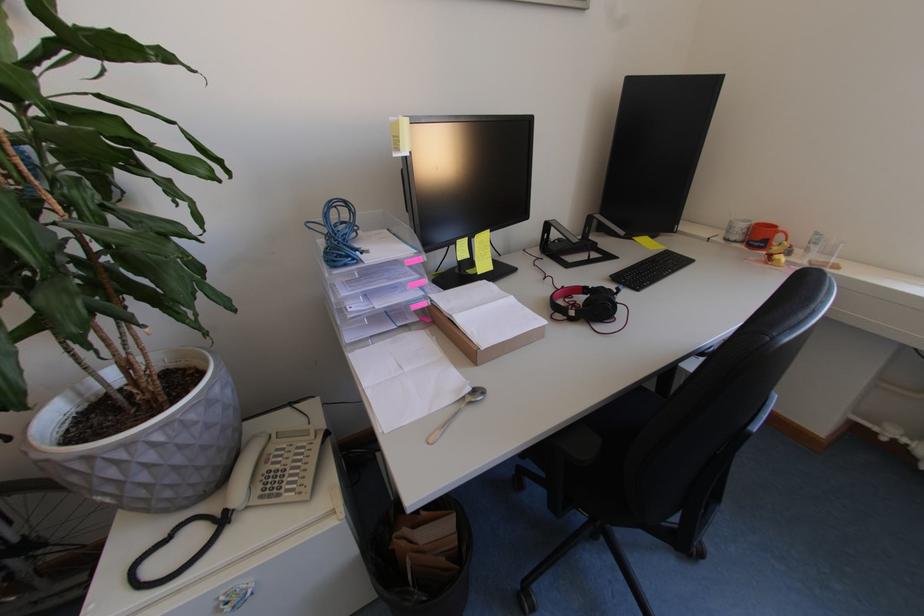
Identify the location of chair armrest. The height and width of the screenshot is (616, 924). (578, 444).